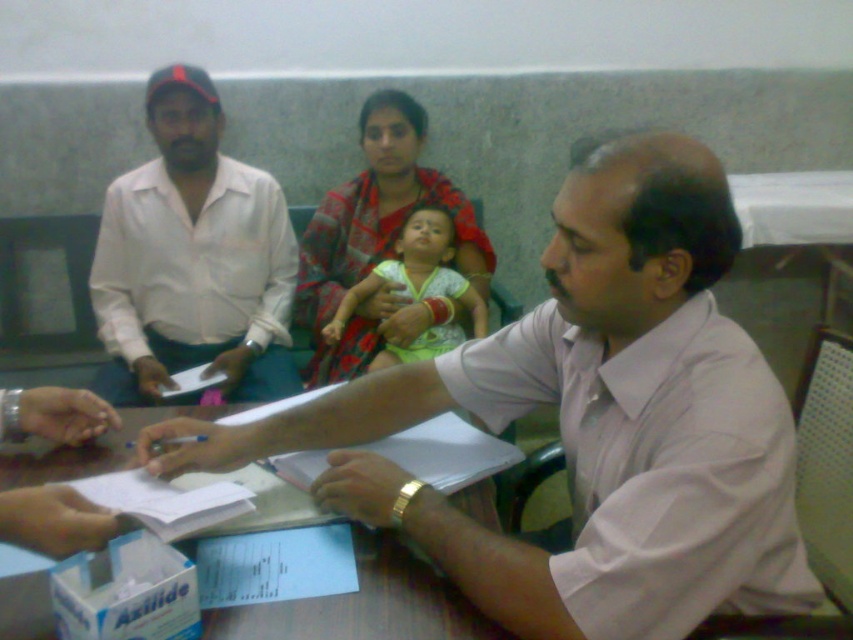
You are a fashion designer observing two shirts in the scene. The pink fabric shirt at center and the white cotton shirt at left. Which one has a greater width?

The pink fabric shirt at center has a greater width than the white cotton shirt at left according to the description.

You are standing at the entrance of the room and see two points marked in the scene. Which point is closer to you, point (291, 499) or point (416, 342)?

Point (291, 499) is in front of point (416, 342), so it is closer to you.